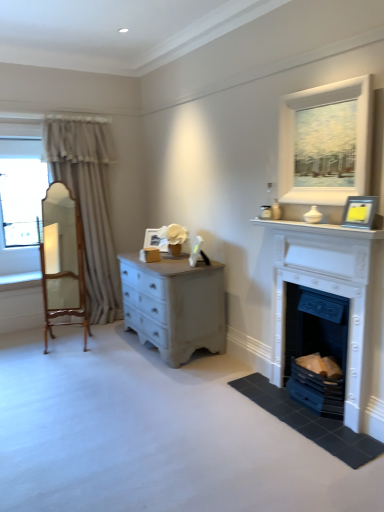
What is the approximate width of beige fabric curtain at left?

It is 33.05 inches.

Find the location of a particular element. This screenshot has height=512, width=384. beige fabric curtain at left is located at coordinates (89, 205).

Image resolution: width=384 pixels, height=512 pixels. What do you see at coordinates (341, 141) in the screenshot?
I see `matte white painting at upper right` at bounding box center [341, 141].

Image resolution: width=384 pixels, height=512 pixels. Identify the location of matte white painting at upper right. (341, 141).

From the picture: Measure the distance between point (313,389) and camera.

Point (313,389) is 2.94 meters from camera.

Measure the distance between wooden armchair at left and camera.

wooden armchair at left and camera are 14.50 feet apart from each other.

Measure the distance between point [380,231] and camera.

The depth of point [380,231] is 7.80 feet.

Find the location of a particular element. beige fabric curtain at left is located at coordinates (89, 205).

Considering the relative positions of beige fabric curtain at left and white painted stone fireplace at right, acting as the 2th fireplace starting from the bottom, in the image provided, is beige fabric curtain at left to the left of white painted stone fireplace at right, acting as the 2th fireplace starting from the bottom, from the viewer's perspective?

Yes.

Is beige fabric curtain at left wider or thinner than white painted stone fireplace at right, acting as the 2th fireplace starting from the bottom?

Considering their sizes, beige fabric curtain at left looks broader than white painted stone fireplace at right, acting as the 2th fireplace starting from the bottom.

Is the position of beige fabric curtain at left more distant than that of white painted stone fireplace at right, the first fireplace viewed from the top?

Yes.

From the image's perspective, would you say beige fabric curtain at left is shown under white painted stone fireplace at right, the first fireplace viewed from the top?

No.

Is silver metallic picture frame at upper right, the second picture frame positioned from the back, not near white matte picture frame at center, which is the second picture frame from front to back?

Yes, silver metallic picture frame at upper right, the second picture frame positioned from the back, and white matte picture frame at center, which is the second picture frame from front to back, are quite far apart.

Which of these two, silver metallic picture frame at upper right, the second picture frame positioned from the back, or white matte picture frame at center, which ranks as the 2th picture frame in right-to-left order, is wider?

Wider between the two is white matte picture frame at center, which ranks as the 2th picture frame in right-to-left order.

Does silver metallic picture frame at upper right, arranged as the first picture frame when viewed from the right, contain white matte picture frame at center, which is the second picture frame from front to back?

No, white matte picture frame at center, which is the second picture frame from front to back, is not inside silver metallic picture frame at upper right, arranged as the first picture frame when viewed from the right.

From the image's perspective, between silver metallic picture frame at upper right, the second picture frame positioned from the left, and white matte picture frame at center, which is the second picture frame from front to back, who is located below?

white matte picture frame at center, which is the second picture frame from front to back, appears lower in the image.

Where is `fireplace above the white painted fireplace at lower right, which is the first fireplace in bottom-to-top order (from the image's perspective)`? The width and height of the screenshot is (384, 512). fireplace above the white painted fireplace at lower right, which is the first fireplace in bottom-to-top order (from the image's perspective) is located at coordinates (338, 295).

Does point (339, 313) come closer to viewer compared to point (319, 250)?

That is True.

Does white painted fireplace at lower right, which is the second fireplace from top to bottom, appear on the left side of white painted stone fireplace at right, acting as the 2th fireplace starting from the bottom?

Incorrect, white painted fireplace at lower right, which is the second fireplace from top to bottom, is not on the left side of white painted stone fireplace at right, acting as the 2th fireplace starting from the bottom.

Are white glossy mantle at upper right and white matte picture frame at center, which is the 1th picture frame from left to right, making contact?

They are not placed beside each other.

Who is taller, white glossy mantle at upper right or white matte picture frame at center, which is the second picture frame from front to back?

white matte picture frame at center, which is the second picture frame from front to back, is taller.

Which object is thinner, white glossy mantle at upper right or white matte picture frame at center, which is counted as the 1th picture frame, starting from the back?

white matte picture frame at center, which is counted as the 1th picture frame, starting from the back, is thinner.

Is point (333, 321) less distant than point (74, 280)?

Yes, it is in front of point (74, 280).

Who is more distant, white painted fireplace at lower right, which is the second fireplace from top to bottom, or wooden armchair at left?

wooden armchair at left is more distant.

Are white painted fireplace at lower right, which is the first fireplace in bottom-to-top order, and wooden armchair at left beside each other?

No, white painted fireplace at lower right, which is the first fireplace in bottom-to-top order, is not making contact with wooden armchair at left.

Image resolution: width=384 pixels, height=512 pixels. I want to click on fireplace that is the 2nd object located below the wooden armchair at left (from the image's perspective), so click(316, 349).

From their relative heights in the image, would you say wooden armchair at left is taller or shorter than silver metallic picture frame at upper right, arranged as the first picture frame when viewed from the right?

Considering their sizes, wooden armchair at left has more height than silver metallic picture frame at upper right, arranged as the first picture frame when viewed from the right.

Which of these two, wooden armchair at left or silver metallic picture frame at upper right, which ranks as the 1th picture frame in front-to-back order, is smaller?

silver metallic picture frame at upper right, which ranks as the 1th picture frame in front-to-back order, is smaller.

Does wooden armchair at left have a greater width compared to silver metallic picture frame at upper right, which ranks as the 1th picture frame in front-to-back order?

Yes, wooden armchair at left is wider than silver metallic picture frame at upper right, which ranks as the 1th picture frame in front-to-back order.

From a real-world perspective, is white glossy mantle at upper right below beige fabric curtain at left?

No, from a real-world perspective, white glossy mantle at upper right is not below beige fabric curtain at left.

Considering the sizes of objects white glossy mantle at upper right and beige fabric curtain at left in the image provided, who is bigger, white glossy mantle at upper right or beige fabric curtain at left?

beige fabric curtain at left is bigger.

Which is behind, white glossy mantle at upper right or beige fabric curtain at left?

beige fabric curtain at left is further from the camera.

Is white glossy mantle at upper right aimed at beige fabric curtain at left?

No, white glossy mantle at upper right is not aimed at beige fabric curtain at left.

What are the coordinates of `the 1st fireplace counting from the right side of the beige fabric curtain at left` in the screenshot? It's located at (338, 295).

Locate an element on the screen. This screenshot has width=384, height=512. picture frame that is above the white matte picture frame at center, which ranks as the 2th picture frame in right-to-left order (from the image's perspective) is located at coordinates (360, 211).

When comparing their distances from white painted fireplace at lower right, which is the second fireplace from top to bottom, does white painted stone fireplace at right, acting as the 2th fireplace starting from the bottom, or silver metallic picture frame at upper right, arranged as the first picture frame when viewed from the right, seem closer?

white painted stone fireplace at right, acting as the 2th fireplace starting from the bottom.

Based on the photo, estimate the real-world distances between objects in this image. Which object is closer to wooden armchair at left, white matte picture frame at center, which is the 1th picture frame from left to right, or matte white painting at upper right?

Among the two, white matte picture frame at center, which is the 1th picture frame from left to right, is located nearer to wooden armchair at left.

Based on their spatial positions, is white painted fireplace at lower right, which is the second fireplace from top to bottom, or white glossy mantle at upper right further from white painted stone fireplace at right, the first fireplace viewed from the top?

Based on the image, white glossy mantle at upper right appears to be further to white painted stone fireplace at right, the first fireplace viewed from the top.

Considering their positions, is matte white painting at upper right positioned further to wooden armchair at left than white painted stone fireplace at right, the first fireplace viewed from the top?

Based on the image, matte white painting at upper right appears to be further to wooden armchair at left.

Looking at this image, when comparing their distances from white glossy mantle at upper right, does silver metallic picture frame at upper right, which ranks as the 1th picture frame in front-to-back order, or white matte picture frame at center, which is counted as the 1th picture frame, starting from the back, seem further?

white matte picture frame at center, which is counted as the 1th picture frame, starting from the back.

When comparing their distances from silver metallic picture frame at upper right, arranged as the first picture frame when viewed from the right, does beige fabric curtain at left or white matte picture frame at center, which ranks as the 2th picture frame in right-to-left order, seem closer?

The object closer to silver metallic picture frame at upper right, arranged as the first picture frame when viewed from the right, is white matte picture frame at center, which ranks as the 2th picture frame in right-to-left order.

Looking at the image, which one is located closer to white painted stone fireplace at right, the first fireplace viewed from the top, beige fabric curtain at left or white matte picture frame at center, which is counted as the 1th picture frame, starting from the back?

The object closer to white painted stone fireplace at right, the first fireplace viewed from the top, is white matte picture frame at center, which is counted as the 1th picture frame, starting from the back.

Based on their spatial positions, is matte white painting at upper right or silver metallic picture frame at upper right, the second picture frame positioned from the left, further from white matte picture frame at center, which is the 1th picture frame from left to right?

silver metallic picture frame at upper right, the second picture frame positioned from the left.

Find the location of a particular element. This screenshot has height=512, width=384. curtain between wooden armchair at left and white painted stone fireplace at right, the first fireplace viewed from the top, in the horizontal direction is located at coordinates (89, 205).

Where is `window between wooden armchair at left and silver metallic picture frame at upper right, the second picture frame positioned from the left, from left to right`? window between wooden armchair at left and silver metallic picture frame at upper right, the second picture frame positioned from the left, from left to right is located at coordinates (341, 141).

Image resolution: width=384 pixels, height=512 pixels. What are the coordinates of `window located between white glossy mantle at upper right and white matte picture frame at center, which ranks as the 2th picture frame in right-to-left order, in the depth direction` in the screenshot? It's located at (341, 141).

Locate an element on the screen. This screenshot has width=384, height=512. window between wooden armchair at left and white painted fireplace at lower right, which is the first fireplace in bottom-to-top order, in the horizontal direction is located at coordinates (341, 141).